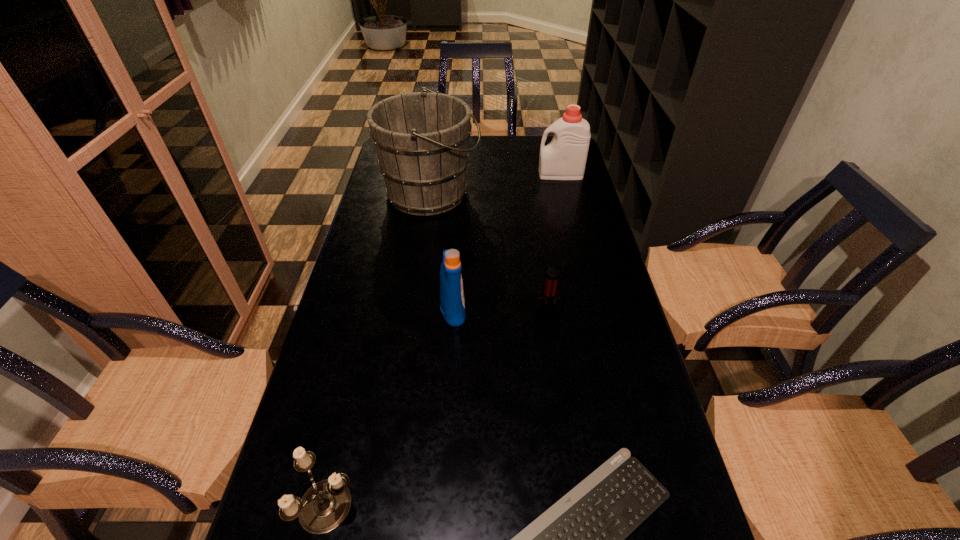
Locate an element on the screen. vacant space that satisfies the following two spatial constraints: 1. on the handle side of the bucket; 2. on the right side of the microphone is located at coordinates tap(413, 316).